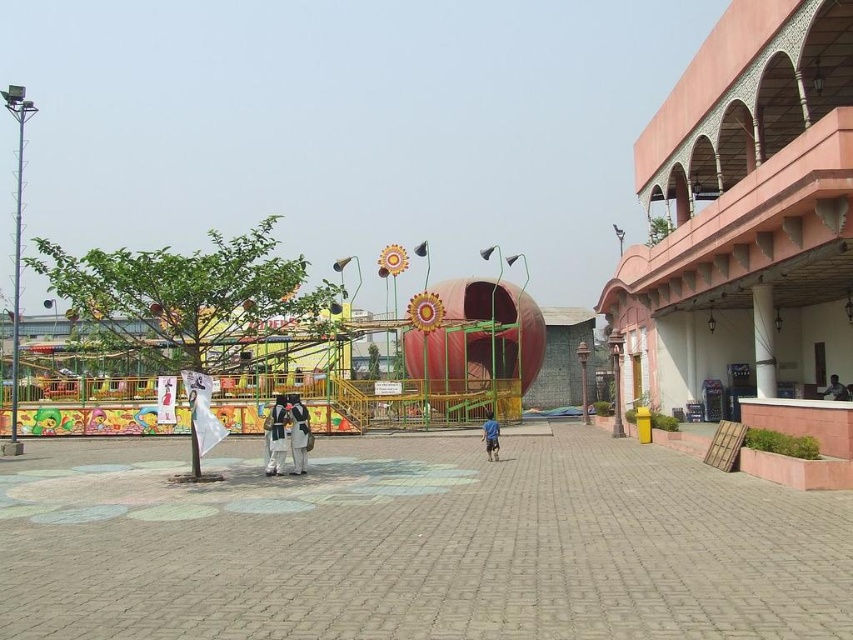
You are standing at the entrance of the amusement park and see the metallic amusement park ride at center and the blue fabric person at center. If you want to reach the ride quickly, which direction should you walk towards?

The metallic amusement park ride at center is 25.51 feet away from the blue fabric person at center. Since you are at the entrance, you should walk towards the metallic amusement park ride at center to reach it quickly.